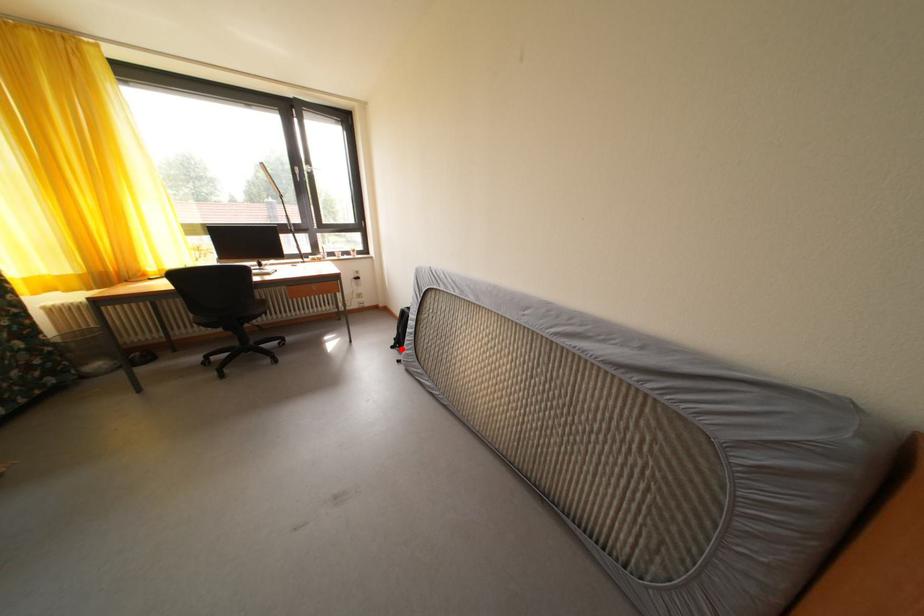
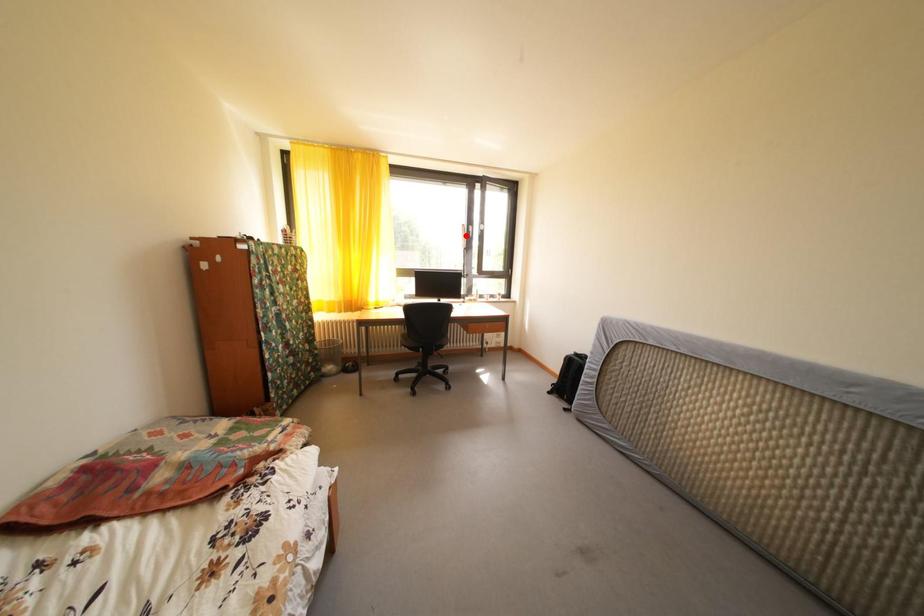
I am providing you with two images of the same scene from different viewpoints. A red point is marked on the first image and another point is marked on the second image. Do the highlighted points in image1 and image2 indicate the same real-world spot?

No